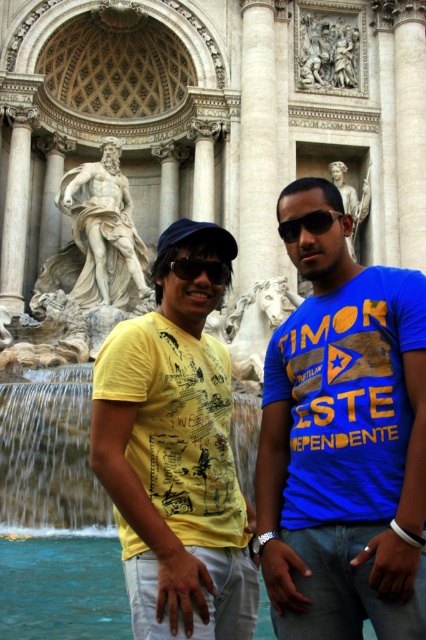
You are standing at the camera position and want to reach the point at coordinates (2, 406). The fountain is between you and that point. Can you walk directly to the point without going around the fountain?

The point at coordinates (2, 406) is 41.43 meters away from the camera. Since the fountain is between you and the point, you would need to go around the fountain to reach it directly.

You are a photographer trying to capture a clear shot of both the translucent water at center and the black plastic sunglasses at center in the image. Since the objects are at the same position, which one will appear more prominent in the photo?

The translucent water at center appears more prominent because it is larger in size than the black plastic sunglasses at center.

You are a photographer trying to capture both pairs of sunglasses in a single photo. Given that the black reflective sunglasses at center are smaller than the black plastic sunglasses at center, which pair should you focus on to ensure they are both clearly visible in the frame?

To ensure both pairs of sunglasses are clearly visible in the frame, focus on the black reflective sunglasses at center since they are smaller and might require closer attention to detail to capture their features accurately.